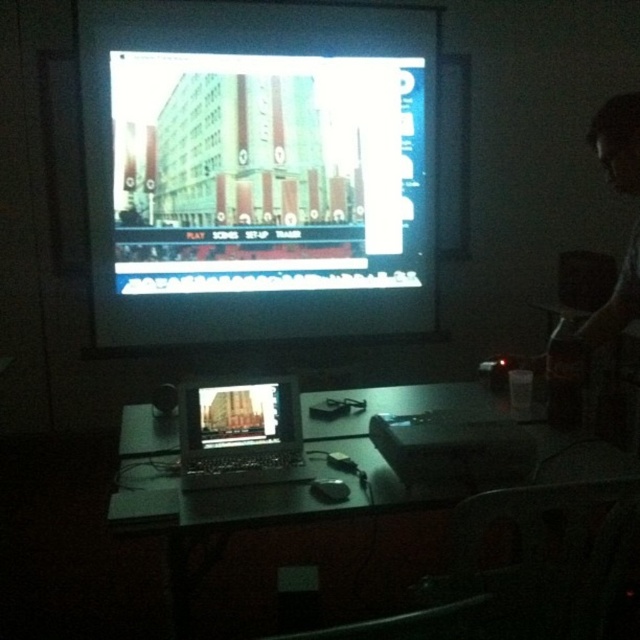
You are an attendee at a presentation and want to see the presentation slide clearly. Which device should you look at, the bright glossy screen at upper center or the black plastic laptop at center?

The bright glossy screen at upper center has a larger size compared to the black plastic laptop at center, so you should look at the bright glossy screen at upper center to see the presentation slide clearly.

You are standing in front of the screen and see the point at coordinates (280, 484). What object is located there?

The metallic silver laptop at lower center is located at point (280, 484).